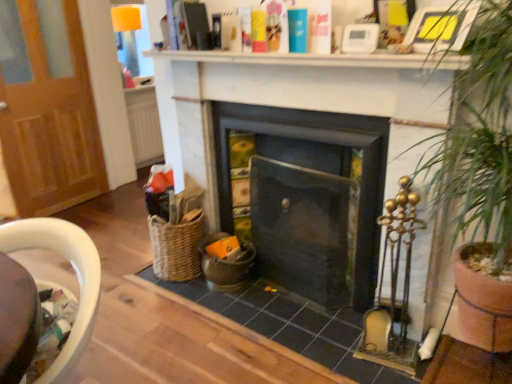
You are a GUI agent. You are given a task and a screenshot of the screen. Output one action in this format:
    pyautogui.click(x=<x>, y=<y>)
    Task: Click on the vacant space in front of matte black fireplace at center, acting as the 2th fireplace starting from the right
    The width and height of the screenshot is (512, 384).
    Given the screenshot: What is the action you would take?
    pyautogui.click(x=302, y=317)